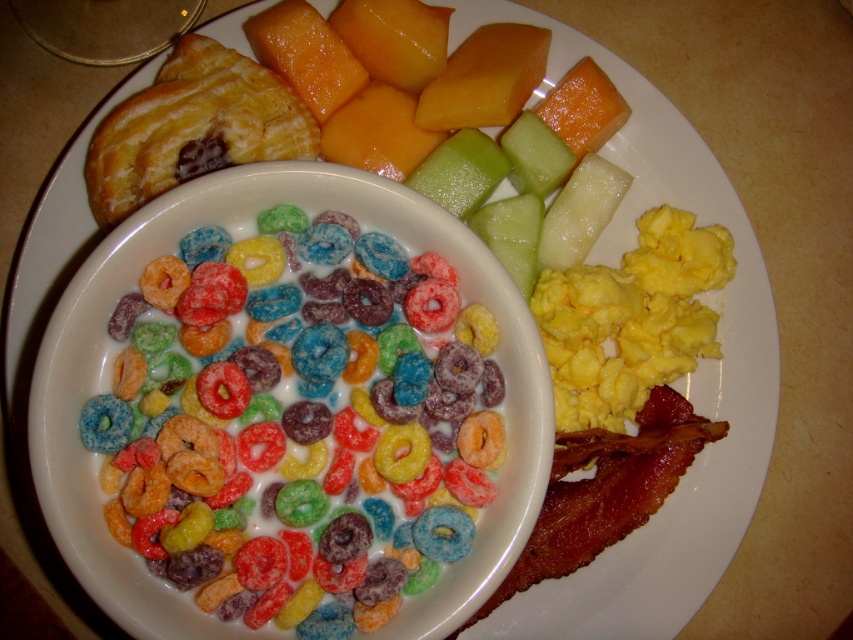
The width and height of the screenshot is (853, 640). Describe the element at coordinates (294, 419) in the screenshot. I see `colorful coated cereal at center` at that location.

Can you confirm if colorful coated cereal at center is positioned below crispy brown bacon at lower right?

Actually, colorful coated cereal at center is above crispy brown bacon at lower right.

Is point (349, 364) positioned in front of point (618, 467)?

That is True.

The image size is (853, 640). I want to click on colorful coated cereal at center, so click(x=294, y=419).

Which is behind, point (326, 440) or point (706, 328)?

Positioned behind is point (706, 328).

Does point (152, 522) come in front of point (577, 330)?

Yes, point (152, 522) is closer to viewer.

Is point (299, 385) positioned behind point (628, 285)?

No, (299, 385) is in front of (628, 285).

Locate an element on the screen. This screenshot has height=640, width=853. colorful coated cereal at center is located at coordinates (294, 419).

Can you confirm if yellow/yellowish matte/scaly scrambled eggs at center-right is positioned above crispy brown bacon at lower right?

Yes.

Who is taller, yellow/yellowish matte/scaly scrambled eggs at center-right or crispy brown bacon at lower right?

yellow/yellowish matte/scaly scrambled eggs at center-right is taller.

The image size is (853, 640). Describe the element at coordinates (631, 320) in the screenshot. I see `yellow/yellowish matte/scaly scrambled eggs at center-right` at that location.

You are a GUI agent. You are given a task and a screenshot of the screen. Output one action in this format:
    pyautogui.click(x=<x>, y=<y>)
    Task: Click on the yellow/yellowish matte/scaly scrambled eggs at center-right
    This screenshot has height=640, width=853.
    Given the screenshot: What is the action you would take?
    pyautogui.click(x=631, y=320)